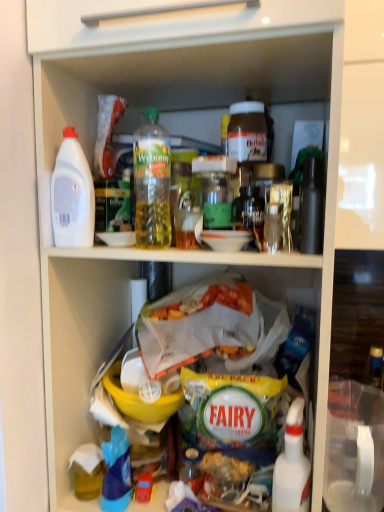
Question: From a real-world perspective, relative to blue plastic bottle at lower left, is translucent plastic bottle at upper center, the fourth bottle viewed from the right, vertically above or below?

Choices:
 (A) above
 (B) below

Answer: (A)

Question: In terms of size, does translucent plastic bottle at upper center, which is counted as the 2th bottle, starting from the left, appear bigger or smaller than blue plastic bottle at lower left?

Choices:
 (A) small
 (B) big

Answer: (B)

Question: Which object is positioned farthest from the white plastic bottle at left, the 5th bottle when ordered from right to left?

Choices:
 (A) white plastic spray bottle at lower right, the first bottle in the right-to-left sequence
 (B) translucent plastic bottle at upper center, the fourth bottle viewed from the right
 (C) blue plastic bottle at lower left
 (D) matte brown jar at upper center, which is the fourth bottle in left-to-right order
 (E) green glass jar at center, positioned as the 3th bottle in left-to-right order

Answer: (A)

Question: Which is farther from the blue plastic bottle at lower left?

Choices:
 (A) green glass jar at center, positioned as the 3th bottle in left-to-right order
 (B) yellow plastic bowl at center
 (C) translucent plastic bottle at upper center, the fourth bottle viewed from the right
 (D) matte brown jar at upper center, which is the fourth bottle in left-to-right order
 (E) white plastic spray bottle at lower right, the first bottle in the right-to-left sequence

Answer: (D)